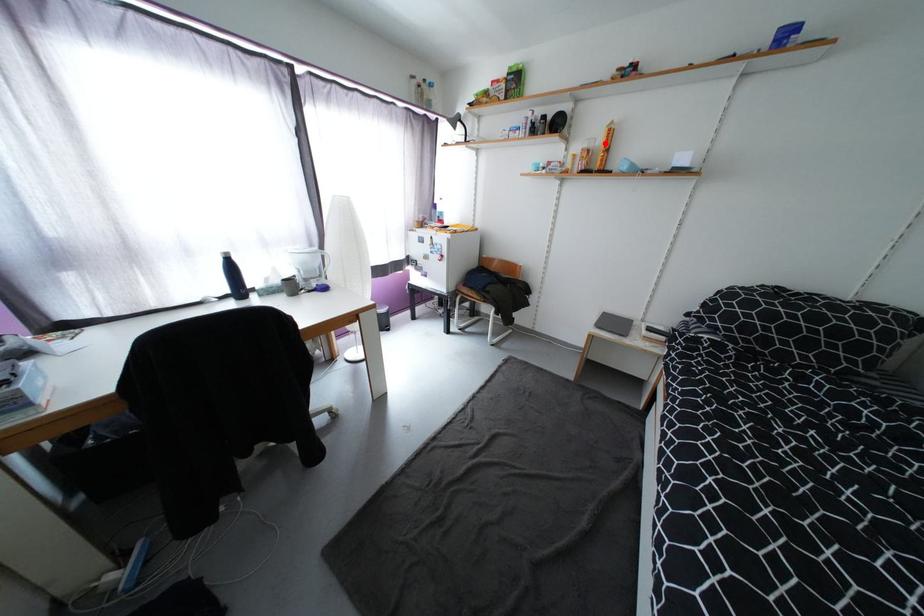
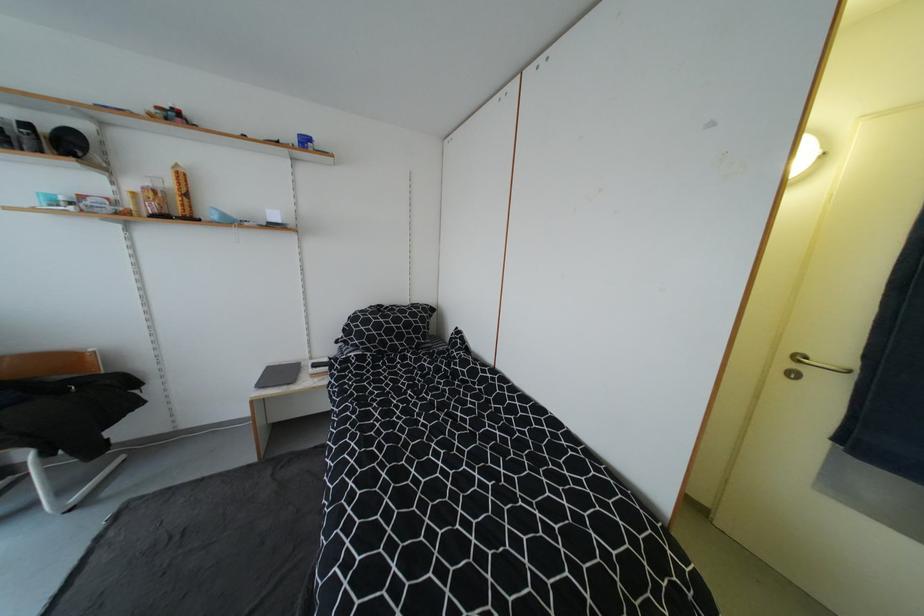
Locate, in the second image, the point that corresponds to the highlighted location in the first image.

(176, 185)